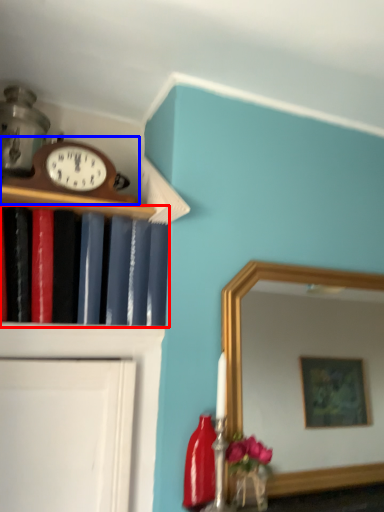
Question: Which point is closer to the camera, book (highlighted by a red box) or wall clock (highlighted by a blue box)?

Choices:
 (A) book
 (B) wall clock

Answer: (A)